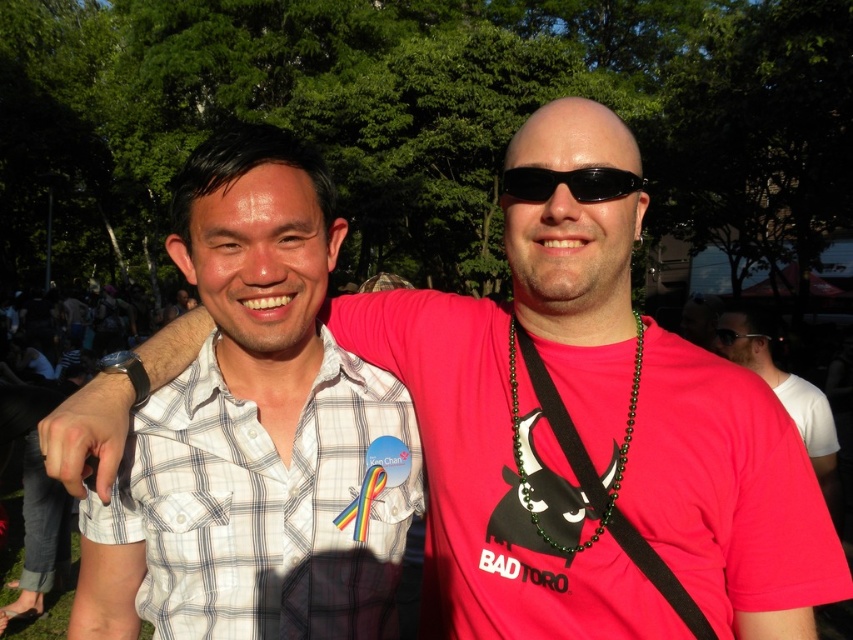
Question: In this image, where is white checkered shirt at left located relative to black plastic sunglasses at center?

Choices:
 (A) right
 (B) left

Answer: (B)

Question: Observing the image, what is the correct spatial positioning of matte pink shirt at center in reference to black plastic sunglasses at center?

Choices:
 (A) below
 (B) above

Answer: (A)

Question: Is white checkered shirt at left above black plastic sunglasses at center?

Choices:
 (A) no
 (B) yes

Answer: (A)

Question: Which object is farther from the camera taking this photo?

Choices:
 (A) black plastic sunglasses at center
 (B) white checkered shirt at left

Answer: (B)

Question: Which point is farther from the camera taking this photo?

Choices:
 (A) (170, 516)
 (B) (527, 168)
 (C) (827, 424)

Answer: (C)

Question: Estimate the real-world distances between objects in this image. Which object is closer to the matte pink shirt at center?

Choices:
 (A) white checkered shirt at left
 (B) black plastic sunglasses at center

Answer: (B)